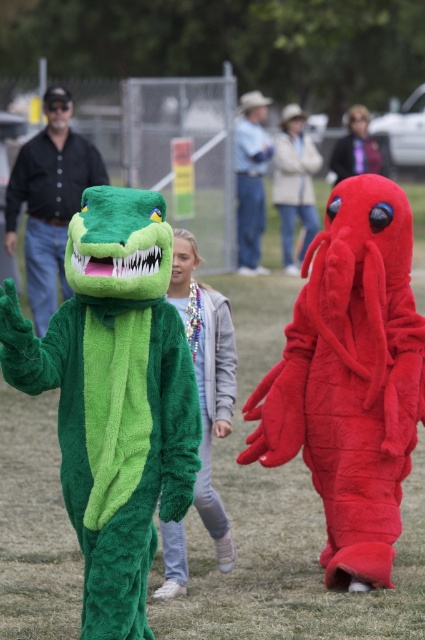
Question: Which point appears farthest from the camera in this image?

Choices:
 (A) (175, 250)
 (B) (99, 448)

Answer: (A)

Question: Which point is closer to the camera?

Choices:
 (A) velvet red octopus at right
 (B) denim jacket at center
 (C) light gray fleece jacket at center

Answer: (C)

Question: Is velvet red octopus at center above blue denim jeans at center?

Choices:
 (A) yes
 (B) no

Answer: (B)

Question: From the image, what is the correct spatial relationship of velvet red octopus at center in relation to velvet red octopus at right?

Choices:
 (A) left
 (B) right

Answer: (A)

Question: Can you confirm if velvet red octopus at right is positioned to the right of light gray fleece jacket at center?

Choices:
 (A) yes
 (B) no

Answer: (A)

Question: Estimate the real-world distances between objects in this image. Which object is farther from the velvet red octopus at right?

Choices:
 (A) blue denim jeans at center
 (B) green plush crocodile at left

Answer: (A)